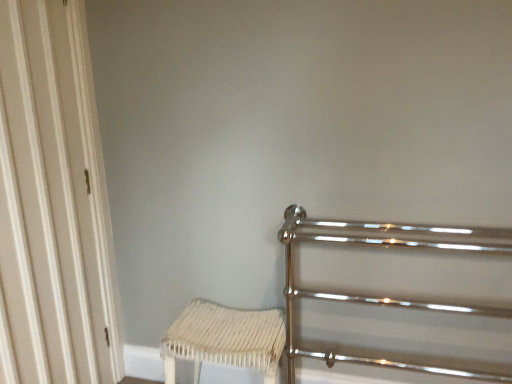
Question: Is white wood door at left facing towards polished chrome rail at right?

Choices:
 (A) no
 (B) yes

Answer: (B)

Question: Would you say white wood door at left is a long distance from polished chrome rail at right?

Choices:
 (A) yes
 (B) no

Answer: (A)

Question: Is white wood door at left not inside polished chrome rail at right?

Choices:
 (A) no
 (B) yes

Answer: (B)

Question: Is white wood door at left smaller than polished chrome rail at right?

Choices:
 (A) yes
 (B) no

Answer: (A)

Question: From the image's perspective, is white wood door at left on polished chrome rail at right?

Choices:
 (A) no
 (B) yes

Answer: (B)

Question: Is white wood door at left shorter than polished chrome rail at right?

Choices:
 (A) no
 (B) yes

Answer: (A)

Question: From a real-world perspective, does polished chrome rail at right sit lower than white woven stool at lower center?

Choices:
 (A) yes
 (B) no

Answer: (B)

Question: Is polished chrome rail at right with white woven stool at lower center?

Choices:
 (A) no
 (B) yes

Answer: (A)

Question: Does polished chrome rail at right have a larger size compared to white woven stool at lower center?

Choices:
 (A) yes
 (B) no

Answer: (A)

Question: Is white woven stool at lower center a part of polished chrome rail at right?

Choices:
 (A) yes
 (B) no

Answer: (B)

Question: Does polished chrome rail at right have a lesser width compared to white woven stool at lower center?

Choices:
 (A) yes
 (B) no

Answer: (A)

Question: Is polished chrome rail at right turned away from white woven stool at lower center?

Choices:
 (A) yes
 (B) no

Answer: (B)

Question: Considering the relative sizes of white wood door at left and white woven stool at lower center in the image provided, is white wood door at left shorter than white woven stool at lower center?

Choices:
 (A) no
 (B) yes

Answer: (A)